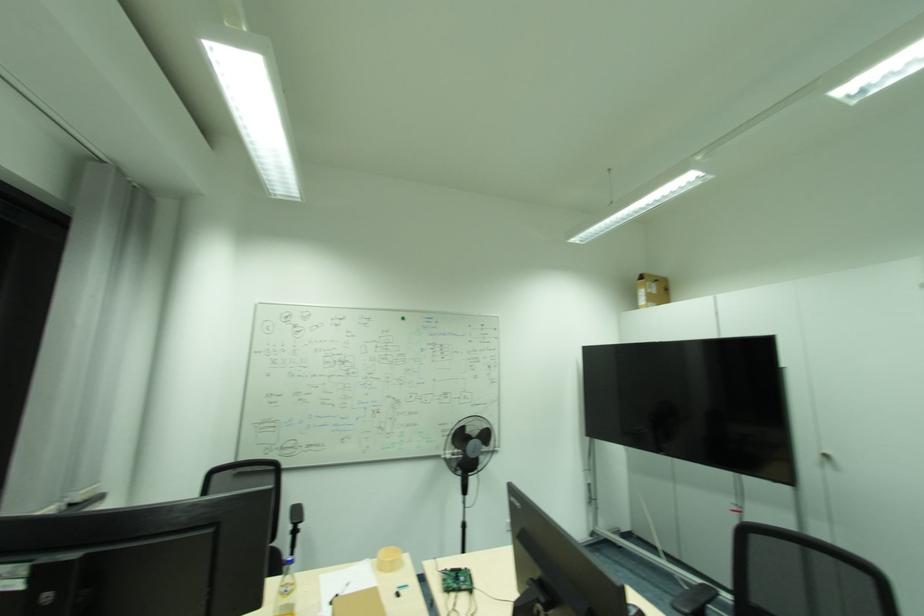
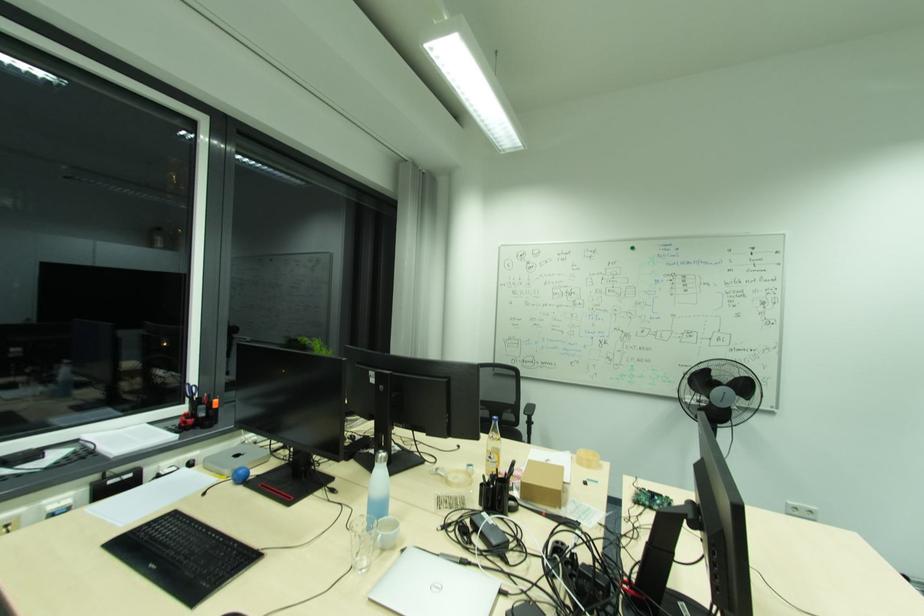
Question: How did the camera likely rotate?

Choices:
 (A) Left
 (B) Right
 (C) Up
 (D) Down

Answer: (A)